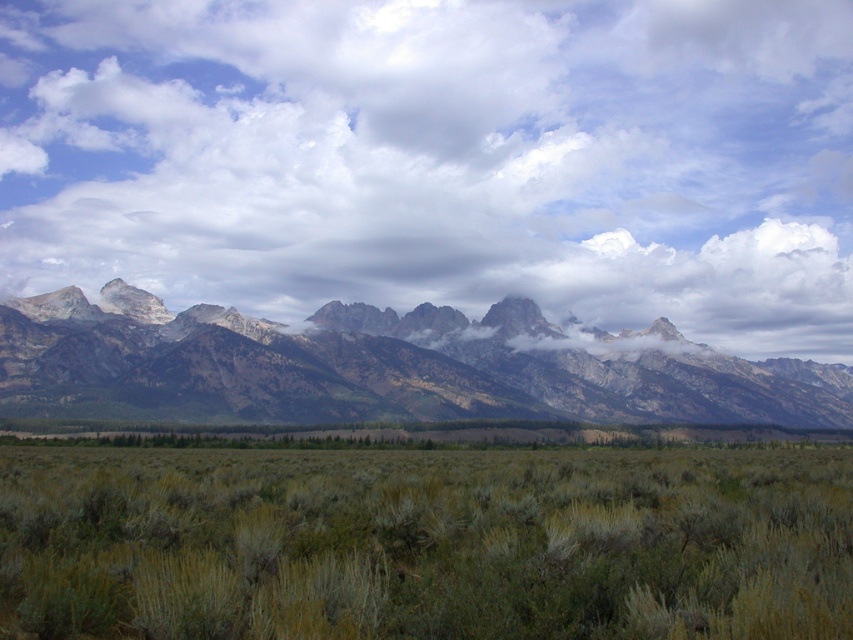
You are standing in the middle of the open landscape and looking towards the mountains. A point marked at coordinates (440, 157) is visible in your field of view. What does this point indicate?

The point at coordinates (440, 157) marks the cloudy sky at upper center.

You are an airplane pilot flying over the landscape described. You need to determine if the gray rock mountain range at center is visible above or below the cloudy sky at upper center. Based on the scene, what do you observe?

The gray rock mountain range at center is behind the cloudy sky at upper center, so it appears below the cloudy sky at upper center from the pilot perspective.